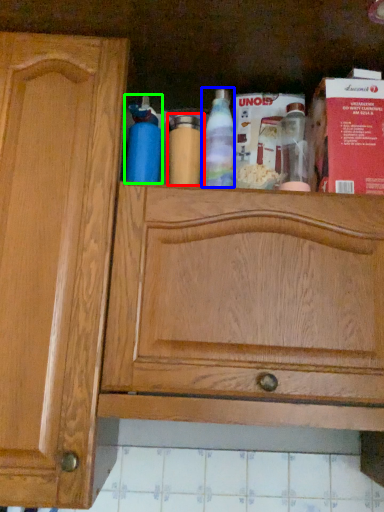
Question: Considering the real-world distances, which object is farthest from bottle (highlighted by a red box)? bottle (highlighted by a blue box) or bottle (highlighted by a green box)?

Choices:
 (A) bottle
 (B) bottle

Answer: (B)